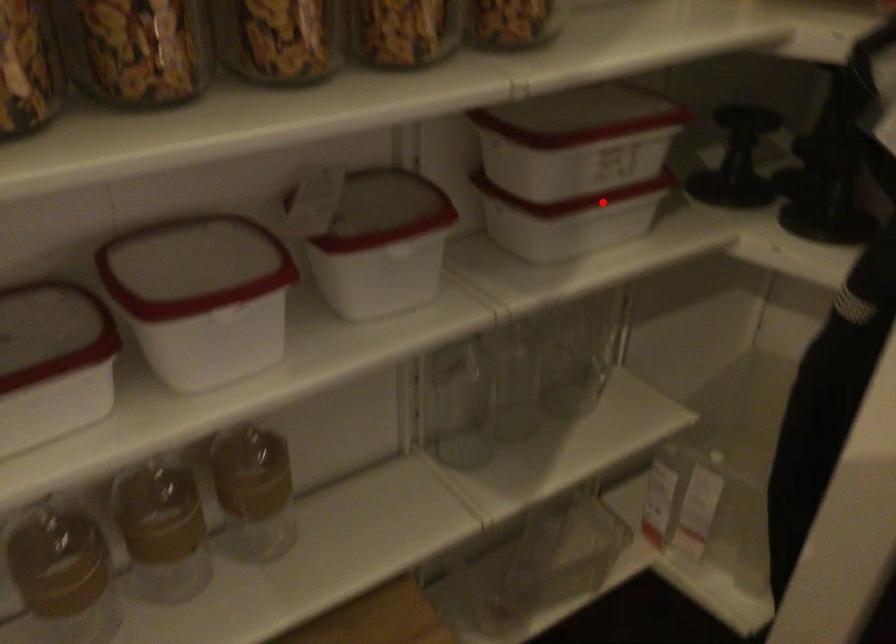
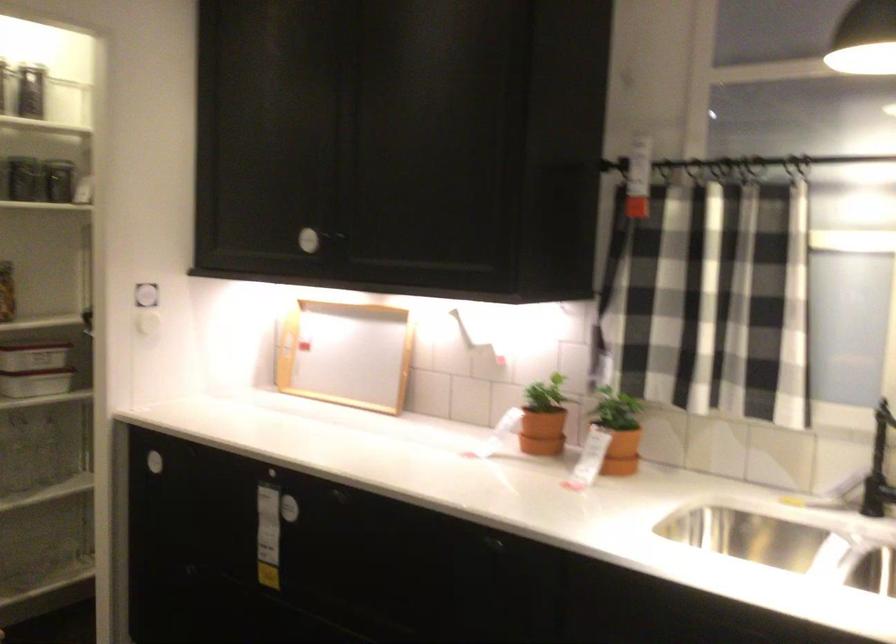
The point at the highlighted location is marked in the first image. Where is the corresponding point in the second image?

(35, 368)